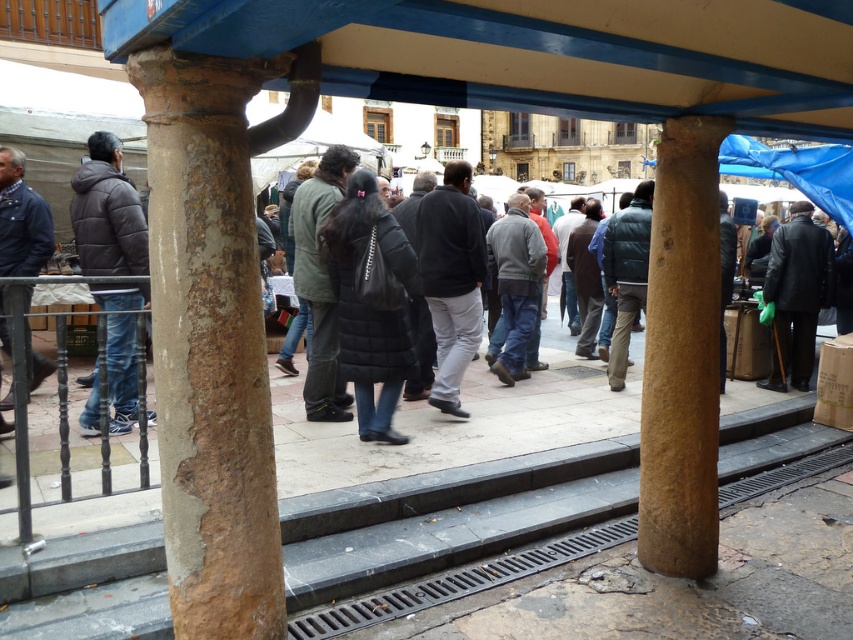
You are a delivery person carrying a box that is 3 meters long. You need to walk through the market area under the covered structure. Can you pass between the rusty stone pillar at center and the dark gray sweater at center without tilting the box?

The distance between the rusty stone pillar at center and the dark gray sweater at center is 2.56 meters. Since the box is 3 meters long, it is longer than the available space, so you cannot pass through without tilting the box.

You are standing under the covered market structure and want to take a photo of the dark gray sweater at center without the rusty stone pillar at center blocking the view. Is this possible?

The rusty stone pillar at center is in front of the dark gray sweater at center, so it is blocking the view. To take a photo of the dark gray sweater at center without the pillar, you would need to move around the pillar to a position where the sweater is visible without obstruction.

You are a photographer standing at the edge of the market under the covered structure. You want to take a photo that includes both the rusty stone pillar at center and the dark gray sweater at center. Which object should you focus on first if you want to ensure both are in clear focus, considering their sizes?

The rusty stone pillar at center has a greater height compared to the dark gray sweater at center. Therefore, you should focus on the rusty stone pillar at center first since it is larger and will require more precise focusing to ensure clarity in the photo.